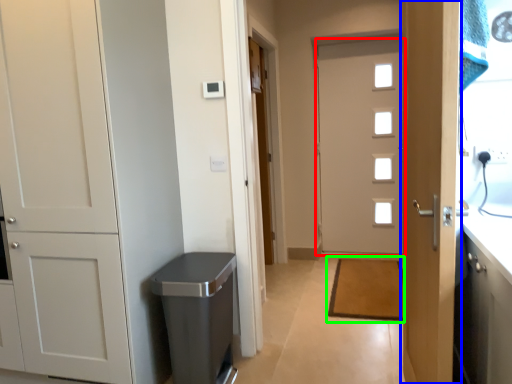
Question: Estimate the real-world distances between objects in this image. Which object is farther from door (highlighted by a red box), door (highlighted by a blue box) or doormat (highlighted by a green box)?

Choices:
 (A) door
 (B) doormat

Answer: (A)